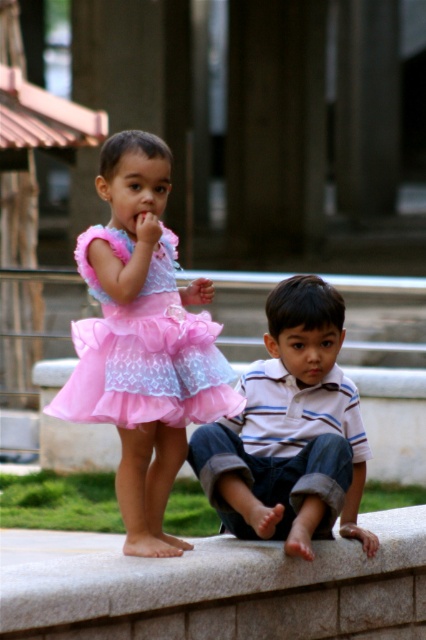
You are a photographer trying to capture the striped cotton shirt at center in the image. The camera you are using has a focus point set at coordinates point (290,432). Will this focus point be effective for capturing the striped cotton shirt at center?

Yes, the focus point at point (290,432) corresponds to the striped cotton shirt at center, so it will be effective for capturing it.

You are a photographer trying to capture a candid shot of two children. You notice the pink tulle dress at upper left and the striped cotton shirt at center. Which child is positioned more to the left side?

The pink tulle dress at upper left is positioned on the left side of striped cotton shirt at center, so the child wearing the pink tulle dress at upper left is more to the left.